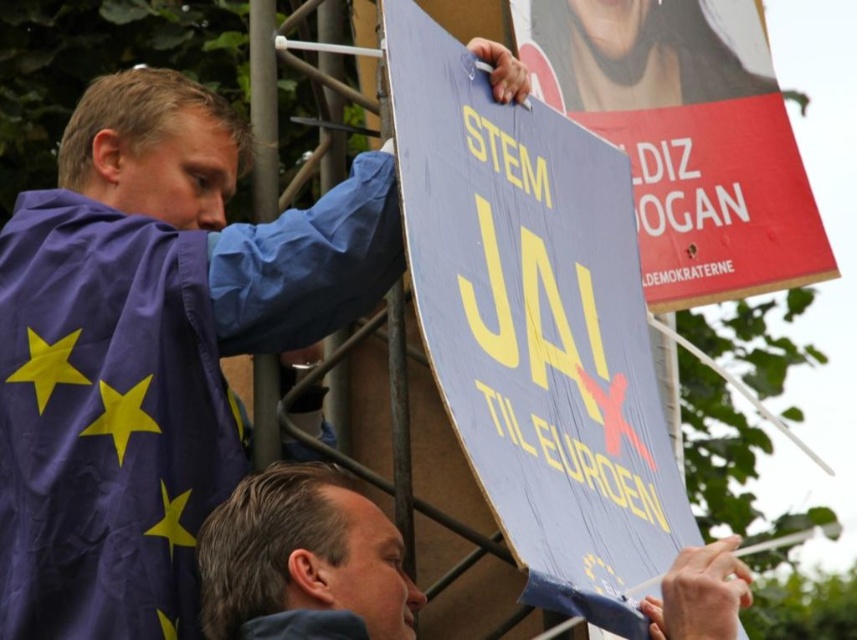
You are a photographer at the rally trying to capture both the purple fabric robe at upper left and the smooth blue sign at center in one shot. Which object should you focus on first to ensure both are in frame?

You should focus on the purple fabric robe at upper left first since it is closer to you than the smooth blue sign at center, ensuring both remain in the frame by starting with the closer object.

You are a photographer at the rally and want to capture both the purple fabric robe at upper left and the blue jacket with yellow stars at lower right in the same frame. The camera you have can focus on objects within a 40 meter range. Will both subjects be in focus?

The two subjects are 38.06 meters apart, so yes, the photographer can capture both the purple fabric robe at upper left and the blue jacket with yellow stars at lower right in focus since the distance is within the camera range.

From the picture: You are a photographer at the event and need to capture a photo that includes both the purple fabric robe at upper left and the smooth blue sign at center. What is the minimum distance you need to move backward to ensure both objects are in frame?

The purple fabric robe at upper left is 3.40 meters from the smooth blue sign at center. To include both in the frame, the photographer needs to move back at least 3.40 meters.